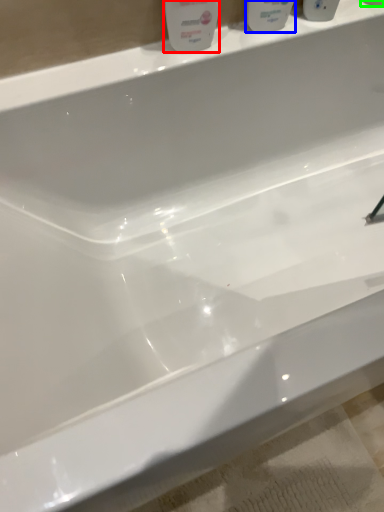
Question: Which object is the farthest from cleaning product (highlighted by a red box)? Choose among these: mouthwash (highlighted by a blue box) or mouthwash (highlighted by a green box).

Choices:
 (A) mouthwash
 (B) mouthwash

Answer: (B)